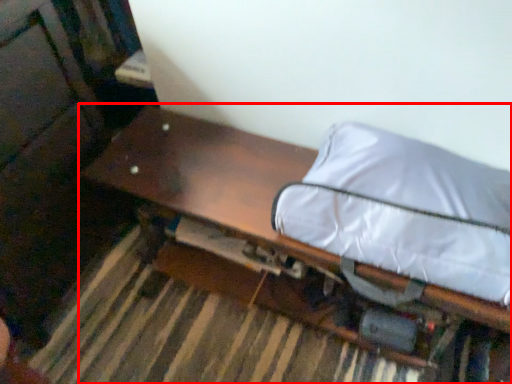
Question: Observing the image, what is the correct spatial positioning of furniture (annotated by the red box) in reference to bean bag chair?

Choices:
 (A) right
 (B) left

Answer: (B)